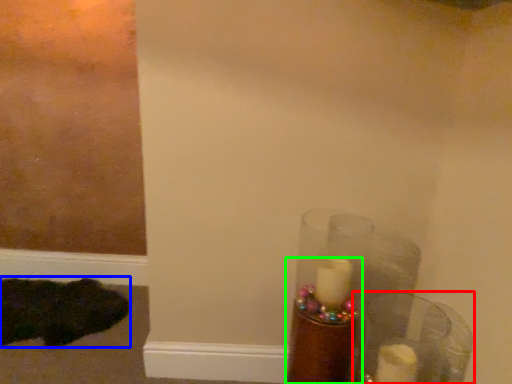
Question: Considering the real-world distances, which object is farthest from glass vase (highlighted by a red box)? animal (highlighted by a blue box) or candle holder (highlighted by a green box)?

Choices:
 (A) animal
 (B) candle holder

Answer: (A)